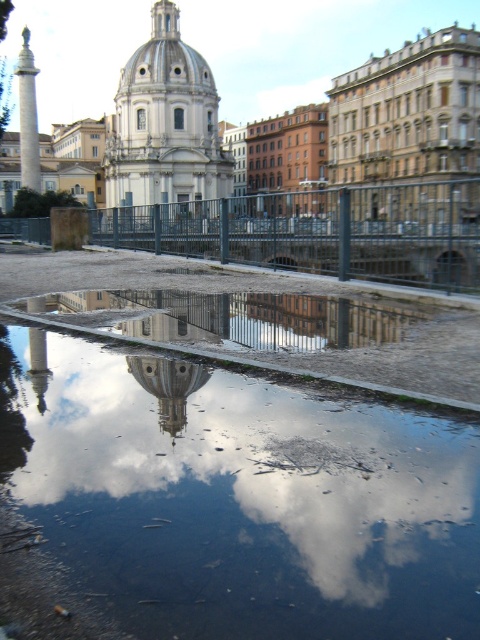
You are standing in the urban scene and want to avoid stepping on the transparent water at center. Based on the coordinates provided, where should you step instead?

The transparent water at center is located at point (240, 499). To avoid it, you should step on areas outside these coordinates, such as to the left or right of the center point.